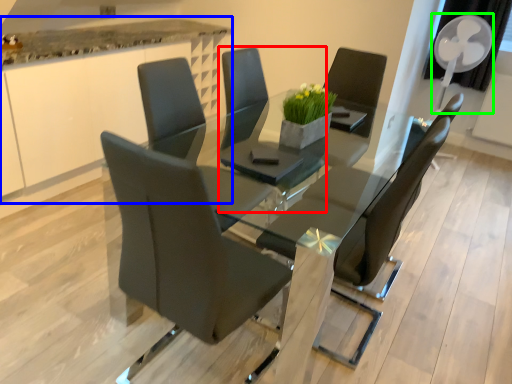
Question: Which is nearer to the chair (highlighted by a red box)? counter (highlighted by a blue box) or mechanical fan (highlighted by a green box).

Choices:
 (A) counter
 (B) mechanical fan

Answer: (A)